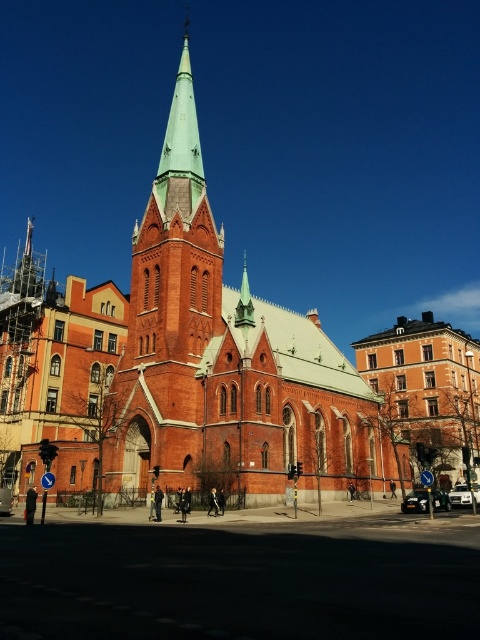
Between metallic silver car at center and metallic silver car at lower left, which one has less height?

Standing shorter between the two is metallic silver car at lower left.

Which is behind, point (434, 490) or point (1, 502)?

The point (434, 490) is more distant.

Does point (446, 509) come closer to viewer compared to point (0, 509)?

That is False.

At what (x,y) coordinates should I click in order to perform the action: click on metallic silver car at center. Please return your answer as a coordinate pair (x, y). The width and height of the screenshot is (480, 640). Looking at the image, I should click on (416, 500).

Is red brick church at center below metallic silver car at center?

Incorrect, red brick church at center is not positioned below metallic silver car at center.

In the scene shown: Can you confirm if red brick church at center is bigger than metallic silver car at center?

Indeed, red brick church at center has a larger size compared to metallic silver car at center.

Where is `red brick church at center`? red brick church at center is located at coordinates (182, 365).

Who is positioned more to the right, red brick church at center or metallic silver car at lower left?

From the viewer's perspective, red brick church at center appears more on the right side.

Which is in front, point (330, 426) or point (1, 504)?

Positioned in front is point (1, 504).

Between point (180, 237) and point (1, 515), which one is positioned behind?

Positioned behind is point (180, 237).

This screenshot has height=640, width=480. What are the coordinates of `red brick church at center` in the screenshot? It's located at (182, 365).